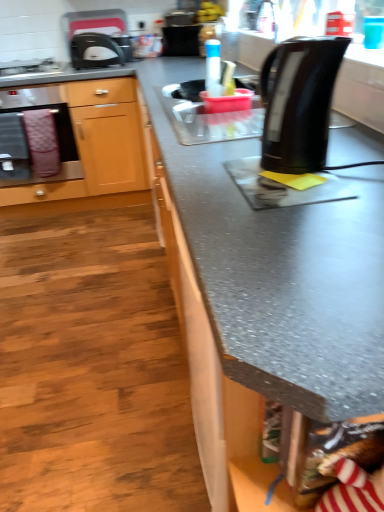
Where is `vacant area that is situated to the right of black glossy electric kettle at right`? This screenshot has height=512, width=384. vacant area that is situated to the right of black glossy electric kettle at right is located at coordinates (354, 155).